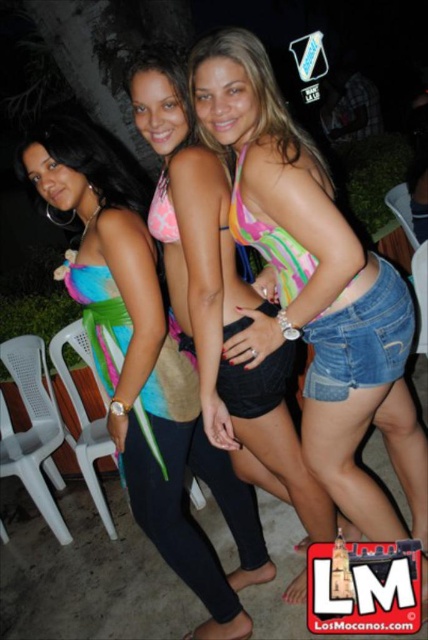
From the picture: Which is more to the left, multicolored fabric bikini top at center or multicolored bikini top at center?

multicolored bikini top at center is more to the left.

Between point (357, 490) and point (162, 525), which one is positioned in front?

Positioned in front is point (357, 490).

The image size is (428, 640). I want to click on multicolored fabric bikini top at center, so pos(315,285).